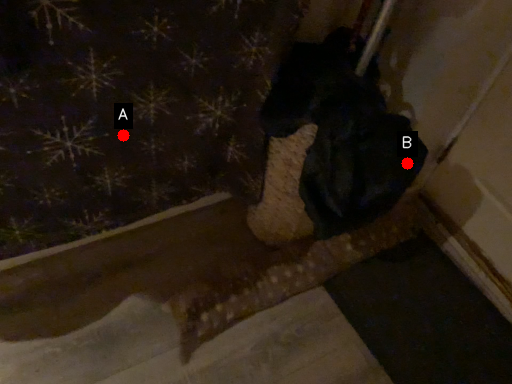
Question: Two points are circled on the image, labeled by A and B beside each circle. Which point appears closest to the camera in this image?

Choices:
 (A) A is closer
 (B) B is closer

Answer: (B)